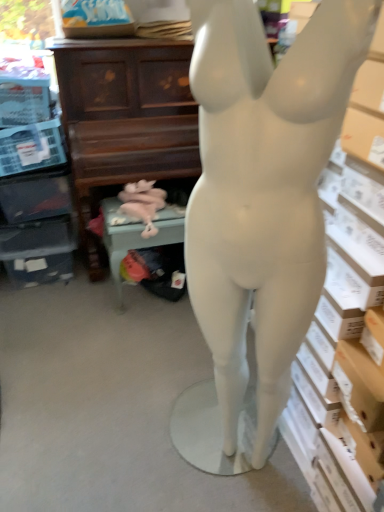
What is the approximate width of green fabric chair at lower center?

14.26 inches.

Measure the distance between pink fabric stuffed animal at lower center and camera.

pink fabric stuffed animal at lower center and camera are 1.99 meters apart.

What do you see at coordinates (124, 119) in the screenshot? This screenshot has height=512, width=384. I see `matte brown piano at upper center` at bounding box center [124, 119].

What do you see at coordinates (263, 189) in the screenshot?
I see `matte white mannequin at center` at bounding box center [263, 189].

Locate an element on the screen. The width and height of the screenshot is (384, 512). green fabric chair at lower center is located at coordinates (136, 234).

Does matte brown piano at upper center have a lesser height compared to green fabric chair at lower center?

No.

From the image's perspective, relative to green fabric chair at lower center, is matte brown piano at upper center above or below?

matte brown piano at upper center is situated higher than green fabric chair at lower center in the image.

How different are the orientations of matte brown piano at upper center and green fabric chair at lower center in degrees?

177 degrees separate the facing orientations of matte brown piano at upper center and green fabric chair at lower center.

Which is less distant, (x=194, y=162) or (x=116, y=241)?

Positioned in front is point (x=116, y=241).

From a real-world perspective, who is located higher, pink fabric stuffed animal at lower center or matte white mannequin at center?

In real-world perspective, matte white mannequin at center is above.

Considering the sizes of objects pink fabric stuffed animal at lower center and matte white mannequin at center in the image provided, who is thinner, pink fabric stuffed animal at lower center or matte white mannequin at center?

Thinner between the two is pink fabric stuffed animal at lower center.

Which point is more forward, (126,185) or (258,153)?

The point (258,153) is closer to the camera.

What's the angular difference between pink fabric stuffed animal at lower center and matte white mannequin at center's facing directions?

66.6 degrees.

Looking at their sizes, would you say matte white mannequin at center is wider or thinner than green fabric chair at lower center?

matte white mannequin at center is thinner than green fabric chair at lower center.

How much distance is there between matte white mannequin at center and green fabric chair at lower center?

3.53 feet.

From the picture: How different are the orientations of matte white mannequin at center and green fabric chair at lower center in degrees?

matte white mannequin at center and green fabric chair at lower center are facing 146 degrees away from each other.

Is matte white mannequin at center looking in the opposite direction of green fabric chair at lower center?

Result: No, matte white mannequin at center is not facing away from green fabric chair at lower center.

The width and height of the screenshot is (384, 512). What are the coordinates of `furniture below the matte brown piano at upper center (from the image's perspective)` in the screenshot? It's located at (136, 234).

Is green fabric chair at lower center in front of or behind matte brown piano at upper center in the image?

green fabric chair at lower center is positioned farther from the viewer than matte brown piano at upper center.

Considering the relative positions of green fabric chair at lower center and matte brown piano at upper center in the image provided, is green fabric chair at lower center to the right of matte brown piano at upper center from the viewer's perspective?

Yes, green fabric chair at lower center is to the right of matte brown piano at upper center.

Between matte brown piano at upper center and pink fabric stuffed animal at lower center, which one appears on the left side from the viewer's perspective?

From the viewer's perspective, matte brown piano at upper center appears more on the left side.

Is there a large distance between matte brown piano at upper center and pink fabric stuffed animal at lower center?

matte brown piano at upper center is actually quite close to pink fabric stuffed animal at lower center.

Does matte brown piano at upper center have a lesser height compared to pink fabric stuffed animal at lower center?

No, matte brown piano at upper center is not shorter than pink fabric stuffed animal at lower center.

Is pink fabric stuffed animal at lower center spatially inside matte brown piano at upper center, or outside of it?

pink fabric stuffed animal at lower center exists outside the volume of matte brown piano at upper center.

How many degrees apart are the facing directions of pink fabric stuffed animal at lower center and matte brown piano at upper center?

30.2 degrees.

Is pink fabric stuffed animal at lower center at the right side of matte brown piano at upper center?

Indeed, pink fabric stuffed animal at lower center is positioned on the right side of matte brown piano at upper center.

In the scene shown: Can you confirm if pink fabric stuffed animal at lower center is shorter than matte brown piano at upper center?

Correct, pink fabric stuffed animal at lower center is not as tall as matte brown piano at upper center.

The image size is (384, 512). What are the coordinates of `person on the right of green fabric chair at lower center` in the screenshot? It's located at (263, 189).

Consider the image. Is green fabric chair at lower center aimed at matte white mannequin at center?

No, green fabric chair at lower center is not aimed at matte white mannequin at center.

Does point (119, 215) appear closer or farther from the camera than point (263, 104)?

Point (119, 215) appears to be farther away from the viewer than point (263, 104).

Between green fabric chair at lower center and matte white mannequin at center, which one appears on the left side from the viewer's perspective?

Positioned to the left is green fabric chair at lower center.

I want to click on entertainment center above the green fabric chair at lower center (from a real-world perspective), so click(124, 119).

This screenshot has height=512, width=384. What are the coordinates of `animal sculpture behind the matte white mannequin at center` in the screenshot? It's located at (143, 203).

In the scene shown: Looking at the image, which one is located further to pink fabric stuffed animal at lower center, matte white mannequin at center or matte brown piano at upper center?

Among the two, matte white mannequin at center is located further to pink fabric stuffed animal at lower center.

When comparing their distances from matte white mannequin at center, does pink fabric stuffed animal at lower center or green fabric chair at lower center seem closer?

The object closer to matte white mannequin at center is green fabric chair at lower center.

Considering their positions, is matte white mannequin at center positioned further to green fabric chair at lower center than pink fabric stuffed animal at lower center?

matte white mannequin at center.

Estimate the real-world distances between objects in this image. Which object is closer to pink fabric stuffed animal at lower center, matte white mannequin at center or green fabric chair at lower center?

The object closer to pink fabric stuffed animal at lower center is green fabric chair at lower center.

Considering their positions, is matte brown piano at upper center positioned closer to green fabric chair at lower center than matte white mannequin at center?

matte brown piano at upper center is closer to green fabric chair at lower center.

Considering their positions, is pink fabric stuffed animal at lower center positioned closer to green fabric chair at lower center than matte brown piano at upper center?

Based on the image, pink fabric stuffed animal at lower center appears to be nearer to green fabric chair at lower center.

Which object lies nearer to the anchor point matte brown piano at upper center, green fabric chair at lower center or matte white mannequin at center?

The object closer to matte brown piano at upper center is green fabric chair at lower center.

Based on their spatial positions, is matte white mannequin at center or matte brown piano at upper center closer to green fabric chair at lower center?

matte brown piano at upper center lies closer to green fabric chair at lower center than the other object.

Image resolution: width=384 pixels, height=512 pixels. I want to click on entertainment center between matte white mannequin at center and green fabric chair at lower center in the front-back direction, so click(x=124, y=119).

This screenshot has height=512, width=384. Identify the location of animal sculpture between matte white mannequin at center and green fabric chair at lower center in the front-back direction. (143, 203).

The height and width of the screenshot is (512, 384). In order to click on entertainment center between matte white mannequin at center and pink fabric stuffed animal at lower center along the z-axis in this screenshot , I will do `click(124, 119)`.

I want to click on animal sculpture that lies between matte brown piano at upper center and green fabric chair at lower center from top to bottom, so click(143, 203).